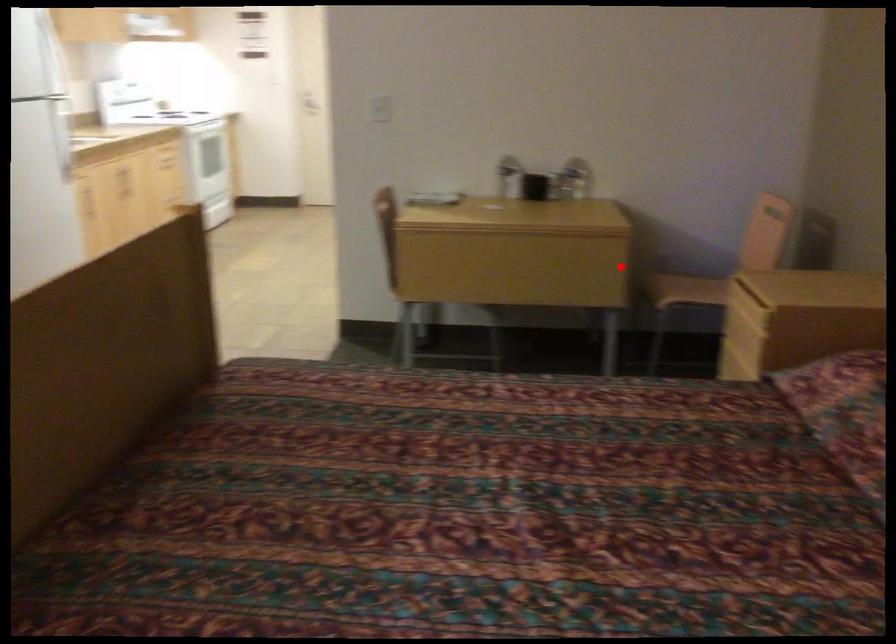
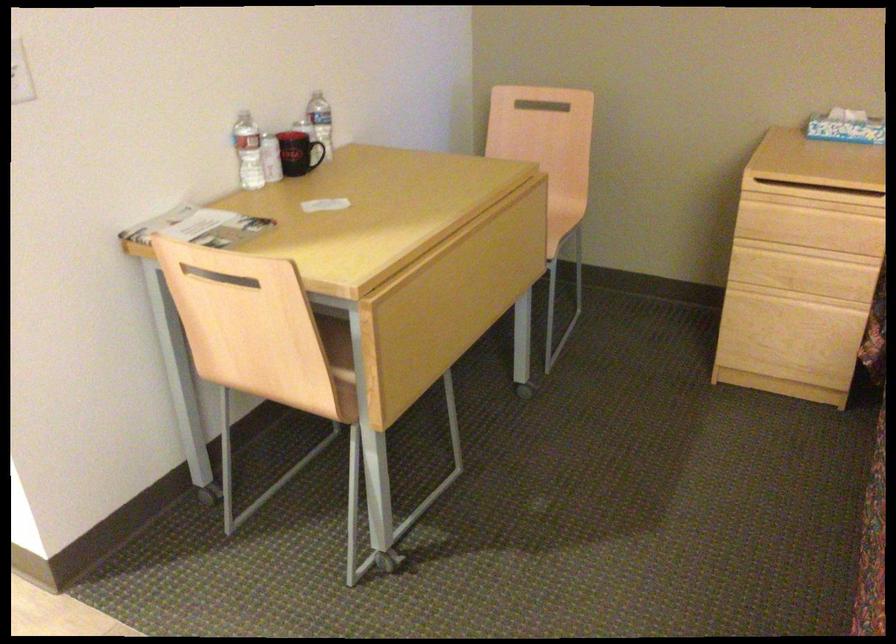
Find the pixel in the second image that matches the highlighted location in the first image.

(545, 225)